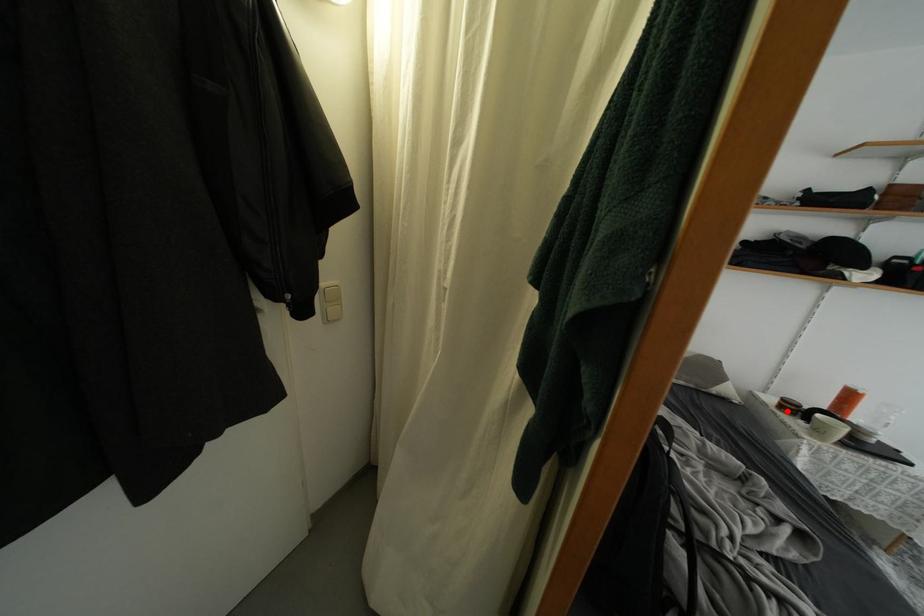
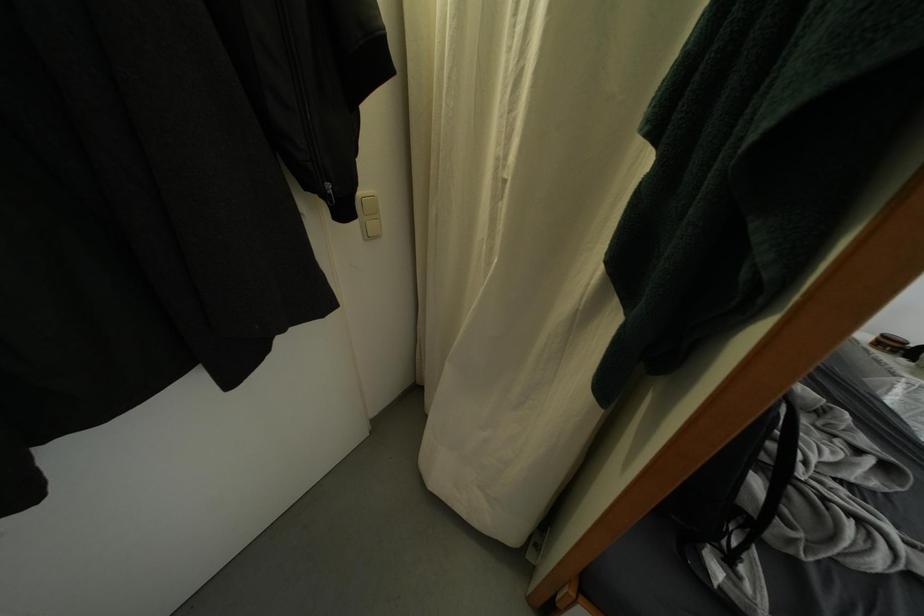
Where in the second image is the point corresponding to the highlighted location from the first image?

(884, 347)